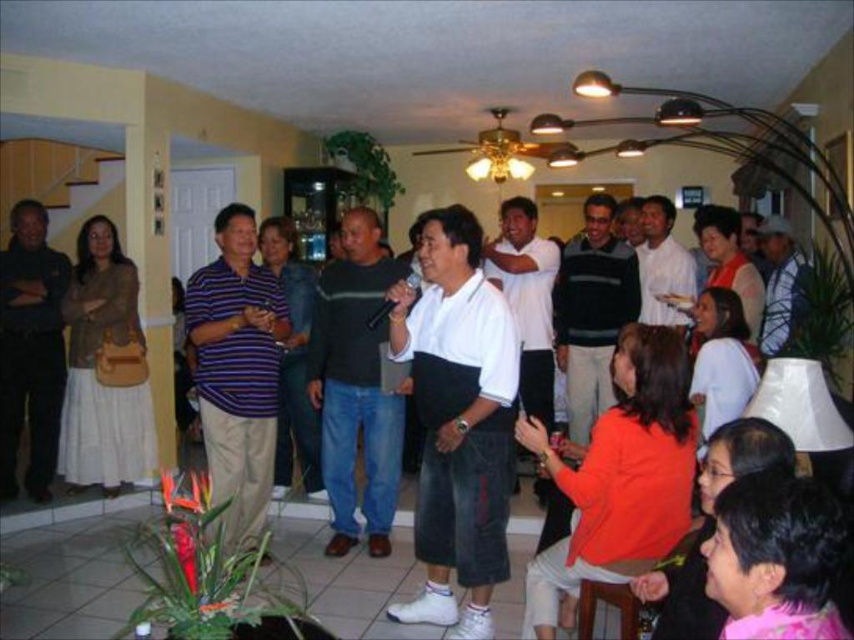
Question: Among these points, which one is nearest to the camera?

Choices:
 (A) click(348, 316)
 (B) click(250, 269)
 (C) click(19, 588)

Answer: (C)

Question: Is dark gray sweater at center to the left of dark brown leather jacket at left from the viewer's perspective?

Choices:
 (A) yes
 (B) no

Answer: (B)

Question: Based on their relative distances, which object is nearer to the white cotton shirt at center?

Choices:
 (A) striped cotton shirt at center
 (B) white matte shirt at center
 (C) dark brown leather jacket at left
 (D) dark gray sweater at center

Answer: (C)

Question: Which of the following is the farthest from the observer?

Choices:
 (A) dark brown leather jacket at left
 (B) dark gray sweater at center
 (C) striped cotton shirt at center
 (D) white matte shirt at center

Answer: (A)

Question: Is white matte shirt at center positioned at the back of white cotton shirt at center?

Choices:
 (A) yes
 (B) no

Answer: (B)

Question: Does white matte shirt at center appear on the left side of dark brown leather jacket at left?

Choices:
 (A) no
 (B) yes

Answer: (A)